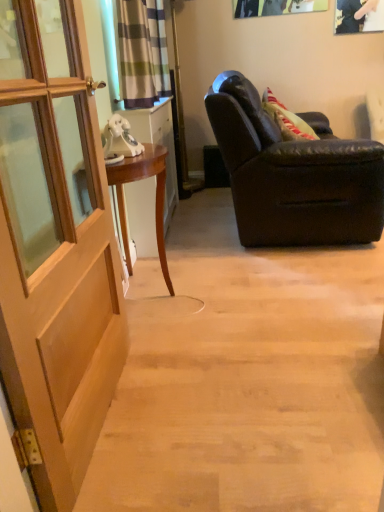
This screenshot has height=512, width=384. In order to click on vacant space underneath mahogany wood desk at left (from a real-world perspective) in this screenshot , I will do `click(151, 300)`.